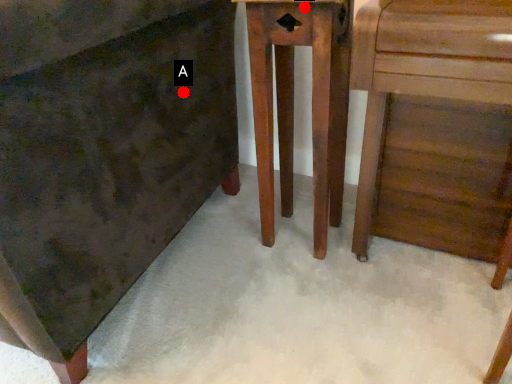
Question: Two points are circled on the image, labeled by A and B beside each circle. Which point appears farthest from the camera in this image?

Choices:
 (A) A is further
 (B) B is further

Answer: (A)